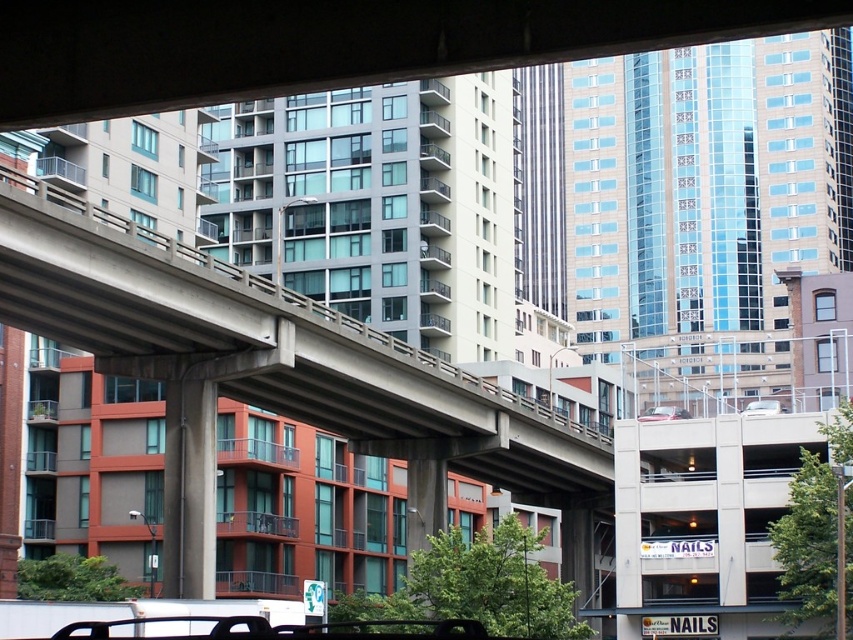
Between concrete at center and metallic silver sedan at center, which one is positioned lower?

concrete at center is lower down.

Is point (189, 280) closer to viewer compared to point (648, 413)?

Yes.

Describe the element at coordinates (273, 349) in the screenshot. I see `concrete at center` at that location.

Where is `concrete at center`? The height and width of the screenshot is (640, 853). concrete at center is located at coordinates (273, 349).

Does metallic silver sedan at center have a lesser height compared to white matte car at center?

No.

Who is positioned more to the right, metallic silver sedan at center or white matte car at center?

white matte car at center

Where is `metallic silver sedan at center`? metallic silver sedan at center is located at coordinates (663, 413).

Where is `metallic silver sedan at center`? Image resolution: width=853 pixels, height=640 pixels. metallic silver sedan at center is located at coordinates (663, 413).

Find the location of a particular element. The width and height of the screenshot is (853, 640). concrete at center is located at coordinates (273, 349).

Based on the photo, is concrete at center above white matte car at center?

No, concrete at center is not above white matte car at center.

The width and height of the screenshot is (853, 640). I want to click on concrete at center, so click(273, 349).